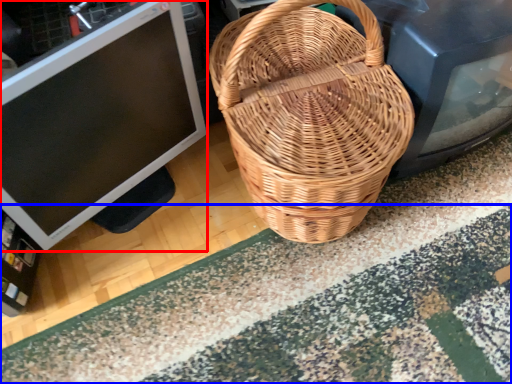
Question: Which of the following is the closest to the observer, computer monitor (highlighted by a red box) or doormat (highlighted by a blue box)?

Choices:
 (A) computer monitor
 (B) doormat

Answer: (A)